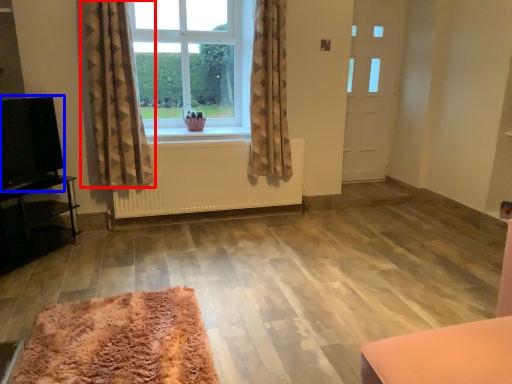
Question: Which point is further to the camera, curtain (highlighted by a red box) or level (highlighted by a blue box)?

Choices:
 (A) curtain
 (B) level

Answer: (A)